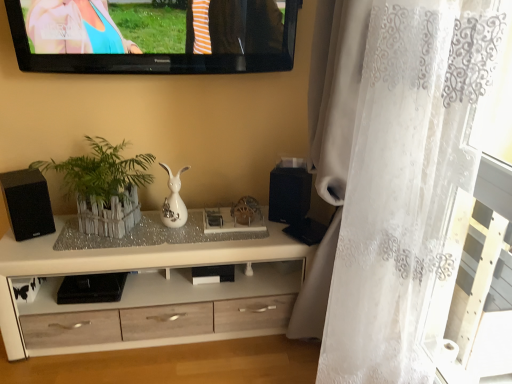
Question: Considering the positions of black matte speaker at center, which is counted as the second speaker, starting from the left, and clear glass tray at center in the image, is black matte speaker at center, which is counted as the second speaker, starting from the left, bigger or smaller than clear glass tray at center?

Choices:
 (A) small
 (B) big

Answer: (B)

Question: Choose the correct answer: Is black matte speaker at center, which is counted as the second speaker, starting from the left, inside clear glass tray at center or outside it?

Choices:
 (A) outside
 (B) inside

Answer: (A)

Question: Estimate the real-world distances between objects in this image. Which object is farther from the black matte speaker at center, which is the 1th speaker from right to left?

Choices:
 (A) white lace curtain at right
 (B) black glossy television at upper center
 (C) black matte speaker at left, arranged as the 2th speaker when viewed from the right
 (D) white glossy vase at center
 (E) clear glass tray at center

Answer: (C)

Question: Based on their relative distances, which object is nearer to the black glossy television at upper center?

Choices:
 (A) white wood cabinet at center
 (B) black matte speaker at center, which is the 1th speaker from right to left
 (C) white glossy vase at center
 (D) black matte speaker at left, marked as the 1th speaker in a left-to-right arrangement
 (E) white wooden fence at center

Answer: (E)